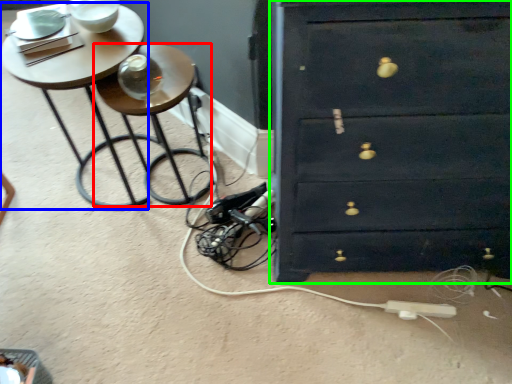
Question: Which object is the farthest from side table (highlighted by a red box)? Choose among these: table (highlighted by a blue box) or chest of drawers (highlighted by a green box).

Choices:
 (A) table
 (B) chest of drawers

Answer: (B)